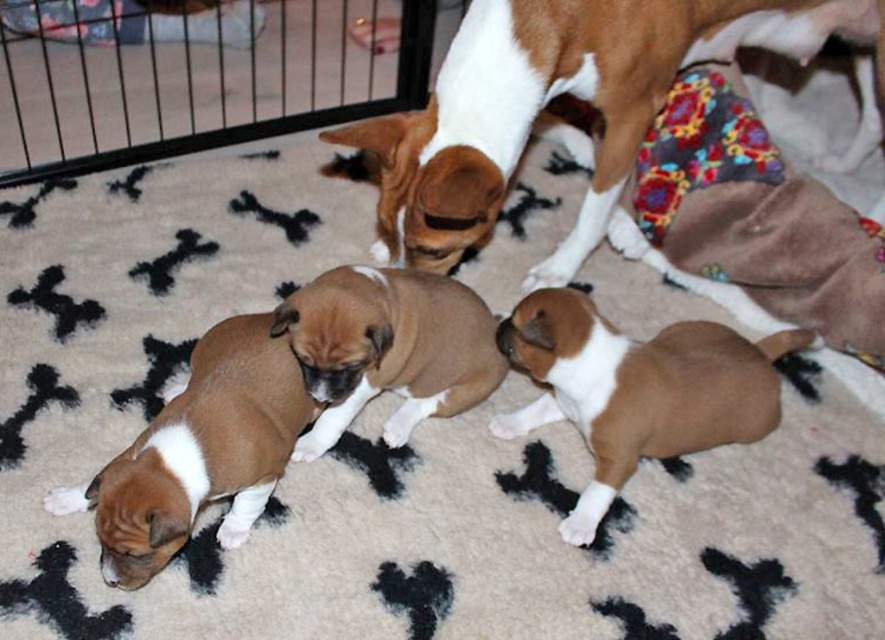
Looking at this image, can you confirm if black metal cage at upper left is wider than brown smooth puppy at center?

Yes, black metal cage at upper left is wider than brown smooth puppy at center.

Who is more forward, [227,44] or [399,419]?

Point [399,419]

Locate an element on the screen. Image resolution: width=885 pixels, height=640 pixels. black metal cage at upper left is located at coordinates (194, 74).

Which is more to the left, brown and white fur at upper center or black metal cage at upper left?

Positioned to the left is black metal cage at upper left.

Is point (460, 202) farther from camera compared to point (1, 168)?

That is False.

Image resolution: width=885 pixels, height=640 pixels. What are the coordinates of `brown and white fur at upper center` in the screenshot? It's located at (568, 93).

Between point (9, 179) and point (137, 586), which one is positioned in front?

Point (137, 586)

Does black metal cage at upper left have a lesser height compared to brown soft fur puppy at lower left?

No.

From the picture: Who is more forward, [129,10] or [222,339]?

Positioned in front is point [222,339].

This screenshot has width=885, height=640. I want to click on black metal cage at upper left, so click(194, 74).